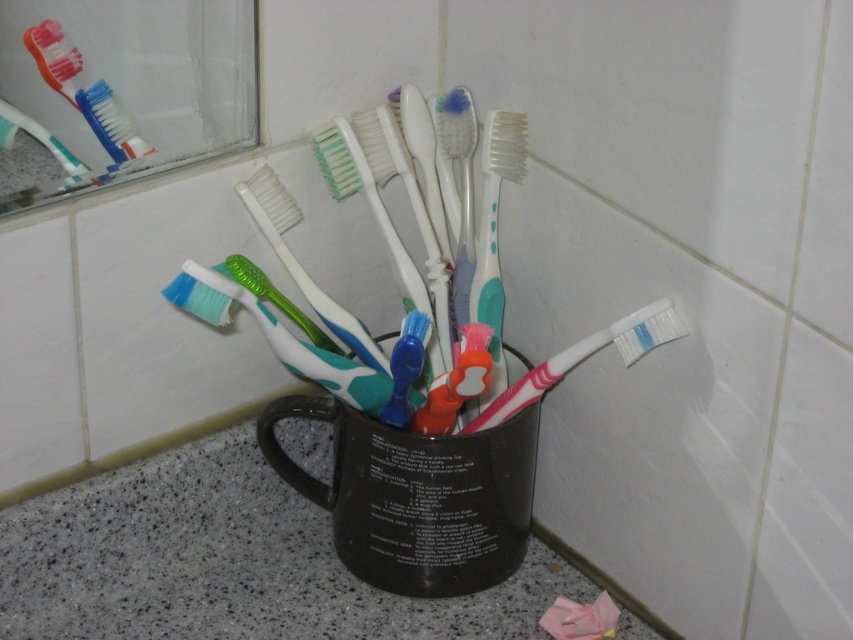
You are organizing the bathroom and need to place the blue rubber toothbrush at center into the black matte mug at center. Can the toothbrush fit vertically inside the mug based on their heights?

The black matte mug at center has a greater height compared to the blue rubber toothbrush at center, so the toothbrush can fit vertically inside the mug.

You are standing in the bathroom scene described. You need to place a new decorative item exactly at the coordinates given for the granite countertop at lower left. What are the coordinates where you should place it?

The coordinates for the granite countertop at lower left are at point (225, 561), so you should place the decorative item there.